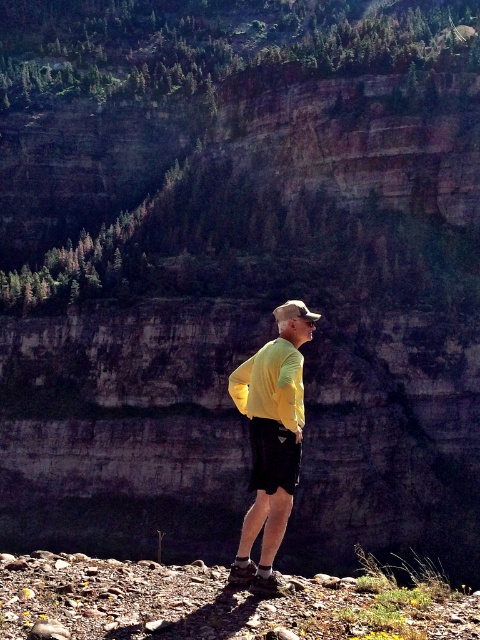
You are a photographer trying to capture the man in the scene. Since you want to ensure both the yellow matte shirt at center and the black cotton shorts at lower center are clearly visible in the photo, which object should you focus on to ensure both are in focus?

The yellow matte shirt at center has a larger size compared to black cotton shorts at lower center, so focusing on the larger yellow matte shirt at center will help ensure both objects are in focus.

You are a hiker who wants to ensure your clothing is properly layered for visibility and safety. Based on the scene, which clothing item is positioned lower on your body between the yellow matte shirt at center and the black cotton shorts at lower center?

The black cotton shorts at lower center are positioned lower on the body since the yellow matte shirt at center is below it.

Based on the scene description, which object is positioned higher up on the man? The yellow matte shirt at center or the black cotton shorts at lower center?

The yellow matte shirt at center is positioned higher up on the man than the black cotton shorts at lower center because it is much taller as black cotton shorts at lower center.